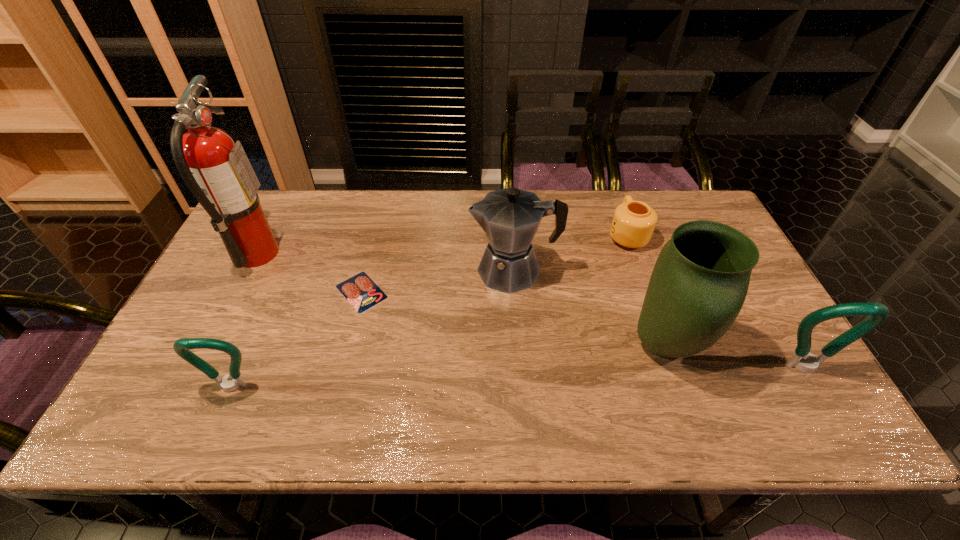
The image size is (960, 540). In order to click on the left bottle opener in this screenshot , I will do `click(181, 346)`.

This screenshot has width=960, height=540. In order to click on the shorter bottle opener in this screenshot , I will do `click(181, 346)`.

The height and width of the screenshot is (540, 960). In order to click on the rightmost object in this screenshot , I will do `click(802, 359)`.

At what (x,y) coordinates should I click in order to perform the action: click on the taller bottle opener. Please return your answer as a coordinate pair (x, y). This screenshot has height=540, width=960. Looking at the image, I should click on (802, 359).

This screenshot has height=540, width=960. I want to click on mug, so click(633, 223).

Locate an element on the screen. This screenshot has width=960, height=540. fire extinguisher is located at coordinates (217, 171).

Where is `salami`? salami is located at coordinates (361, 292).

This screenshot has height=540, width=960. What are the coordinates of `the shortest object` in the screenshot? It's located at (361, 292).

Find the location of a particular element. The width and height of the screenshot is (960, 540). coffeepot is located at coordinates (510, 217).

This screenshot has height=540, width=960. I want to click on vase, so click(x=699, y=283).